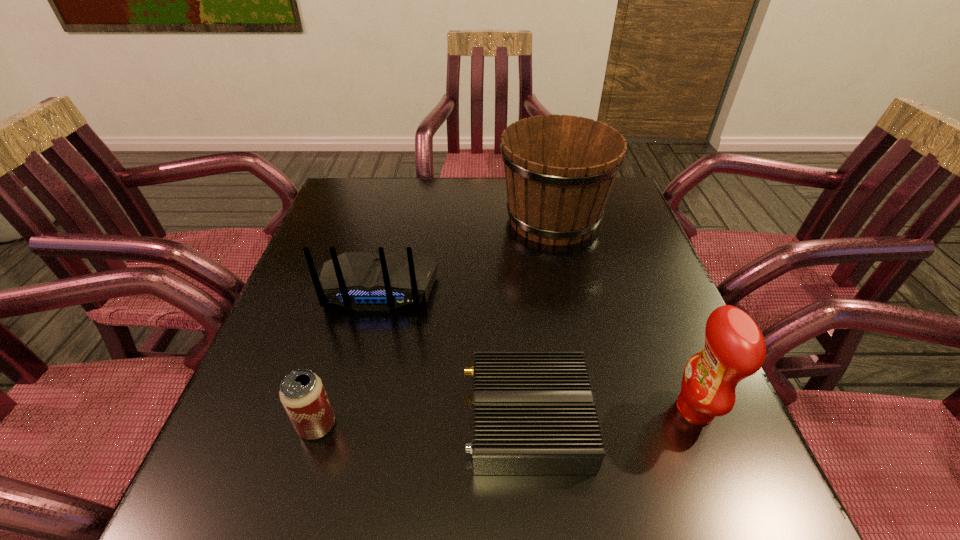
Locate an element on the screen. This screenshot has height=540, width=960. empty location between the third shortest object and the condiment is located at coordinates (537, 348).

This screenshot has height=540, width=960. I want to click on vacant space that is in between the wine bucket and the nearer router, so click(540, 320).

This screenshot has width=960, height=540. I want to click on free space between the farthest object and the taller router, so click(x=466, y=253).

Identify the location of free spot between the second shortest object and the nearer router. The height and width of the screenshot is (540, 960). (422, 423).

At what (x,y) coordinates should I click in order to perform the action: click on free space between the shorter router and the fourth tallest object. Please return your answer as a coordinate pair (x, y). Looking at the image, I should click on (422, 423).

In order to click on free space that is in between the left router and the second shortest object in this screenshot , I will do `click(348, 356)`.

Identify the location of empty space between the taller router and the nearer router. (453, 354).

I want to click on free space between the right router and the taller router, so click(453, 354).

Where is `vacant space that's between the third shortest object and the condiment`? The width and height of the screenshot is (960, 540). vacant space that's between the third shortest object and the condiment is located at coordinates (537, 348).

Locate which object is the third closest to the right router. Please provide its 2D coordinates. Your answer should be formatted as a tuple, i.e. [(x, y)], where the tuple contains the x and y coordinates of a point satisfying the conditions above.

[(302, 394)]